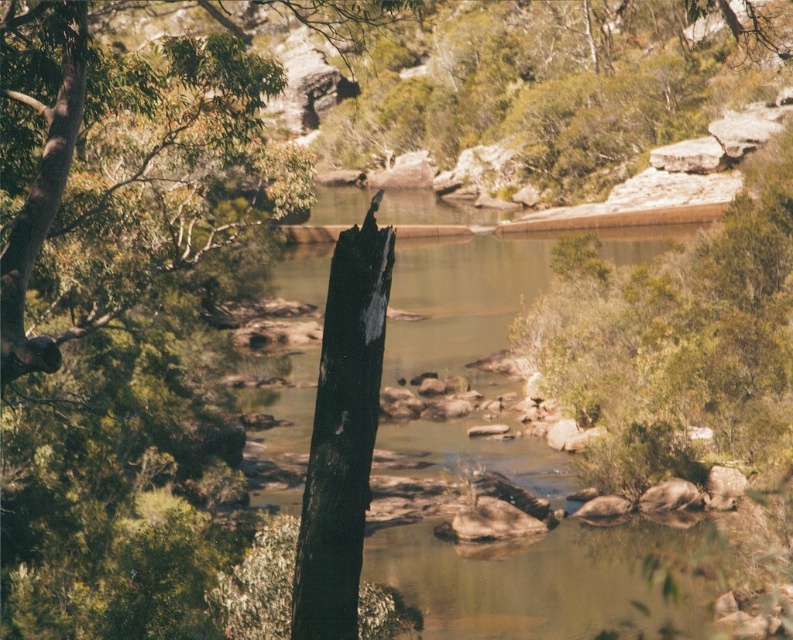
From the picture: You are standing on the riverbank and want to walk towards the clear water at center. There is a green leafy tree at left blocking your path. Can you walk around the tree to reach the water?

The clear water at center is further to the viewer than the green leafy tree at left, meaning the tree is closer to you. Since the tree is blocking your path, you can walk around it to reach the water which is behind the tree.

You are standing on the riverbank and see the clear water at center and the green leafy tree at left. Which object is closer to your right side?

The clear water at center is closer to your right side because it is positioned to the right of the green leafy tree at left.